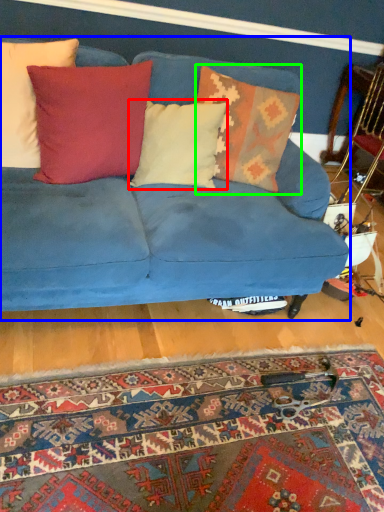
Question: Considering the real-world distances, which object is farthest from pillow (highlighted by a red box)? studio couch (highlighted by a blue box) or pillow (highlighted by a green box)?

Choices:
 (A) studio couch
 (B) pillow

Answer: (A)